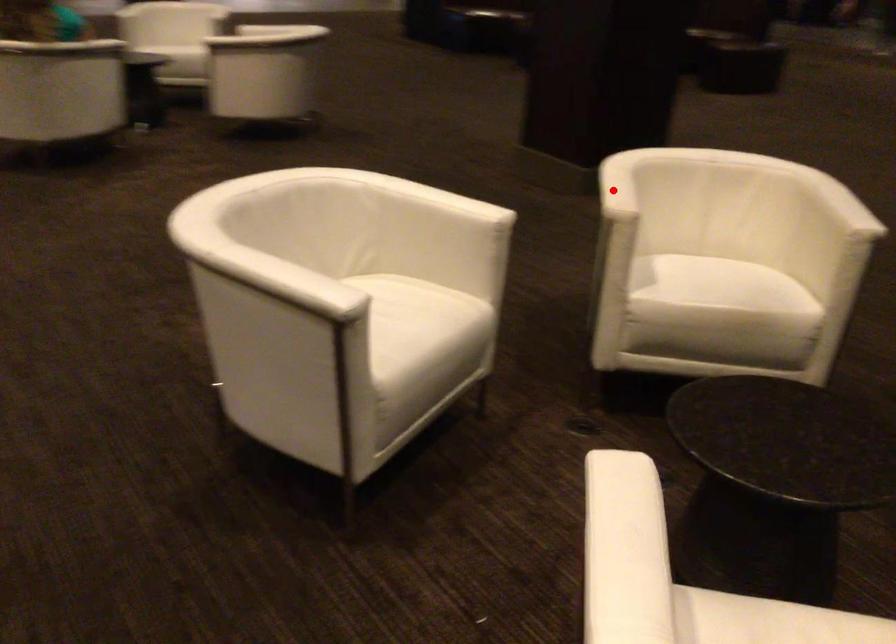
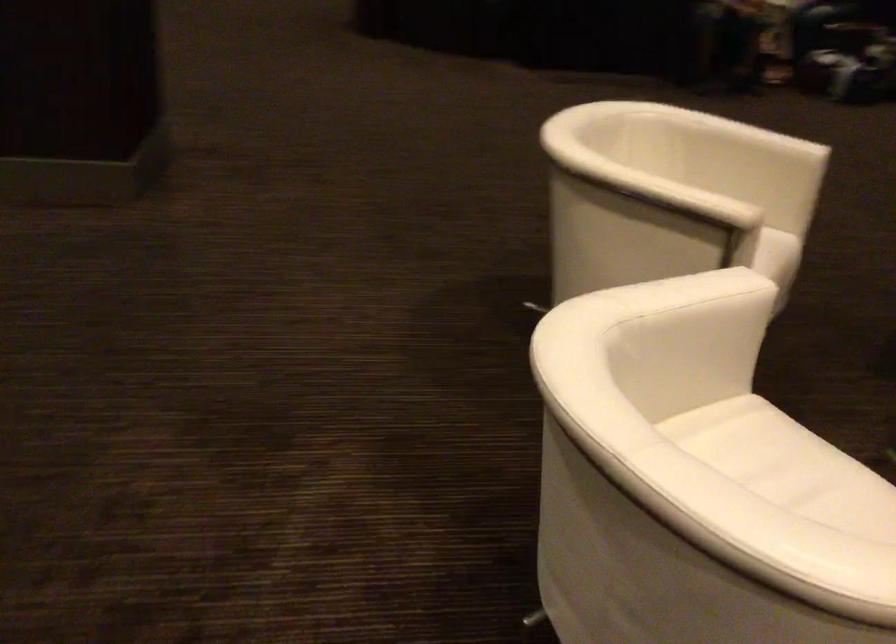
Question: I am providing you with two images of the same scene from different viewpoints. Image1 has a red point marked. In image2, the corresponding 3D location appears at what relative position? Reply with the corresponding letter.

Choices:
 (A) Closer
 (B) Farther

Answer: (A)